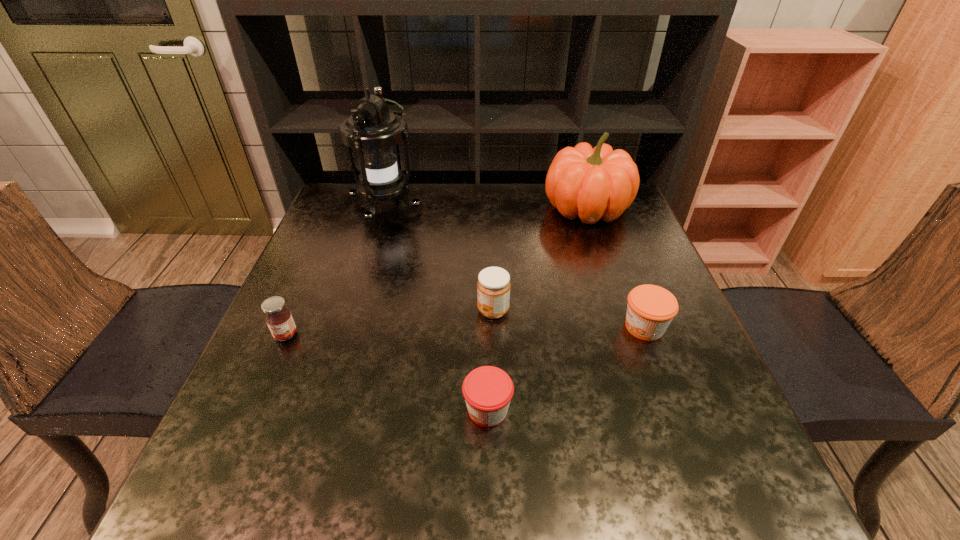
Locate an element on the screen. The image size is (960, 540). lantern is located at coordinates (373, 130).

This screenshot has height=540, width=960. Find the location of `the tallest object`. the tallest object is located at coordinates (373, 130).

Identify the location of the second tallest object. This screenshot has width=960, height=540. (596, 183).

This screenshot has height=540, width=960. In order to click on the leftmost jam in this screenshot , I will do `click(278, 317)`.

Identify the location of the rightmost jam. The height and width of the screenshot is (540, 960). (650, 309).

The image size is (960, 540). Identify the location of the nearest jam. (488, 390).

What are the coordinates of `vacant space located on the front of the tallest object` in the screenshot? It's located at (348, 339).

At what (x,y) coordinates should I click in order to perform the action: click on vacant region located 0.170m on the front of the second tallest object. Please return your answer as a coordinate pair (x, y). Looking at the image, I should click on (608, 275).

This screenshot has height=540, width=960. I want to click on vacant space situated on the label side of the leftmost object, so click(218, 490).

The image size is (960, 540). Identify the location of blank area located 0.090m on the front label of the rightmost jam. (578, 327).